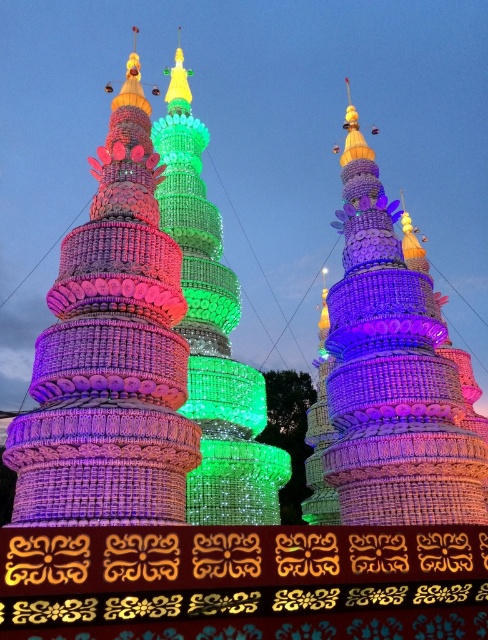
You are standing in front of the three pagoda structures. The matte purple tower at left and the green glass tower at center are both illuminated. Which tower is positioned to the left of the other?

The matte purple tower at left is to the left of the green glass tower at center.

You are an architect designing a new garden and want to place the matte purple tower at left and the multicolored glass beads at center in your design. Based on their widths, which structure should you place closer to the entrance to ensure visitors can easily walk between them?

The matte purple tower at left might be wider than the multicolored glass beads at center, so placing the narrower multicolored glass beads at center closer to the entrance would allow for easier passage between the structures.